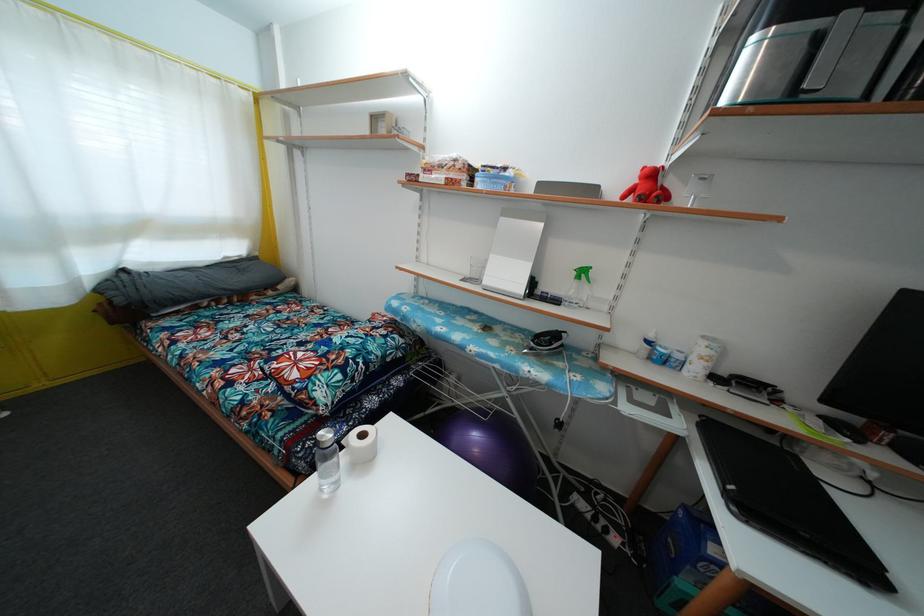
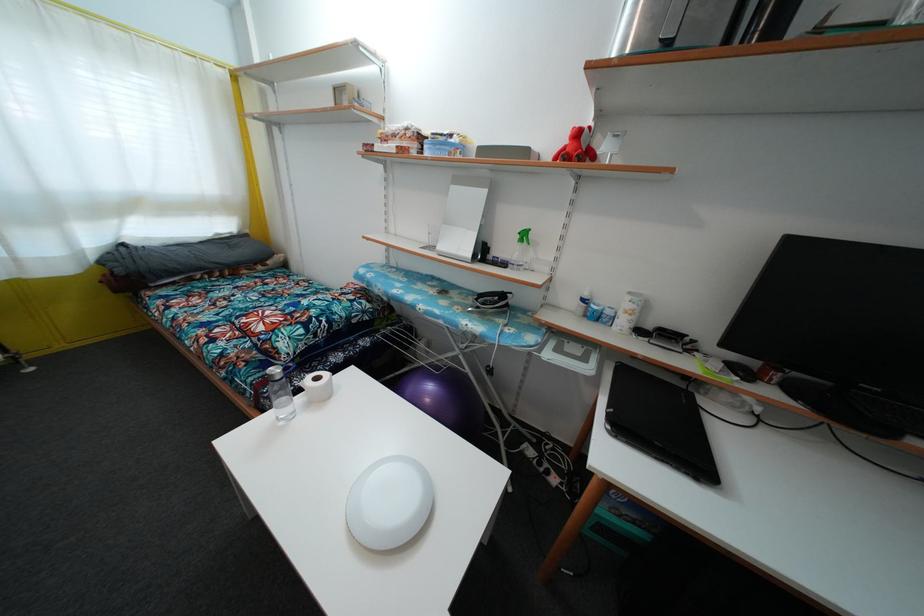
The point at (367,442) is marked in the first image. Where is the corresponding point in the second image?

(321, 386)